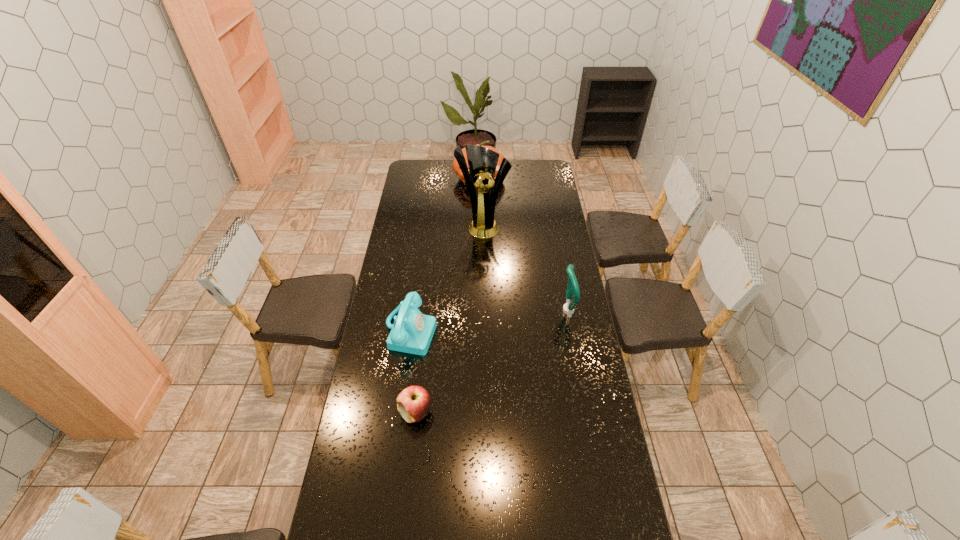
Identify which object is located as the second nearest to the farthest object. Please provide its 2D coordinates. Your answer should be formatted as a tuple, i.e. [(x, y)], where the tuple contains the x and y coordinates of a point satisfying the conditions above.

[(572, 287)]

What are the coordinates of `vacant space that satisfies the following two spatial constraints: 1. on the front side of the nearest object; 2. on the bitten side of the second shortest object` in the screenshot? It's located at (399, 413).

Image resolution: width=960 pixels, height=540 pixels. What are the coordinates of `vacant area that satisfies the following two spatial constraints: 1. on the front side of the award; 2. at the jaws of the rightmost object` in the screenshot? It's located at (484, 310).

At what (x,y) coordinates should I click in order to perform the action: click on blank space that satisfies the following two spatial constraints: 1. on the back side of the telephone; 2. on the left side of the award. Please return your answer as a coordinate pair (x, y). The image size is (960, 540). Looking at the image, I should click on (425, 225).

Identify the location of vacant space that satisfies the following two spatial constraints: 1. on the back side of the fourth tallest object; 2. at the jaws of the rightmost object. The image size is (960, 540). (414, 310).

Where is `vacant space that satisfies the following two spatial constraints: 1. on the front side of the award; 2. on the right side of the farthest object`? This screenshot has height=540, width=960. vacant space that satisfies the following two spatial constraints: 1. on the front side of the award; 2. on the right side of the farthest object is located at coordinates (479, 225).